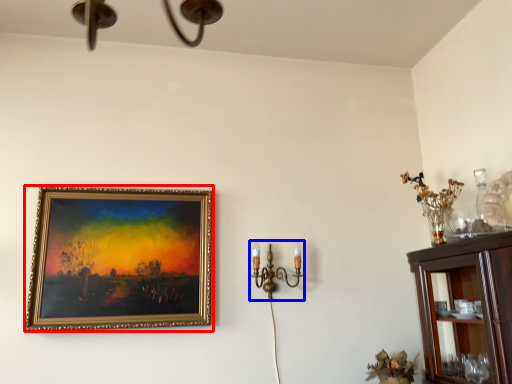
Question: Which object appears farthest to the camera in this image, picture frame (highlighted by a red box) or candle holder (highlighted by a blue box)?

Choices:
 (A) picture frame
 (B) candle holder

Answer: (B)